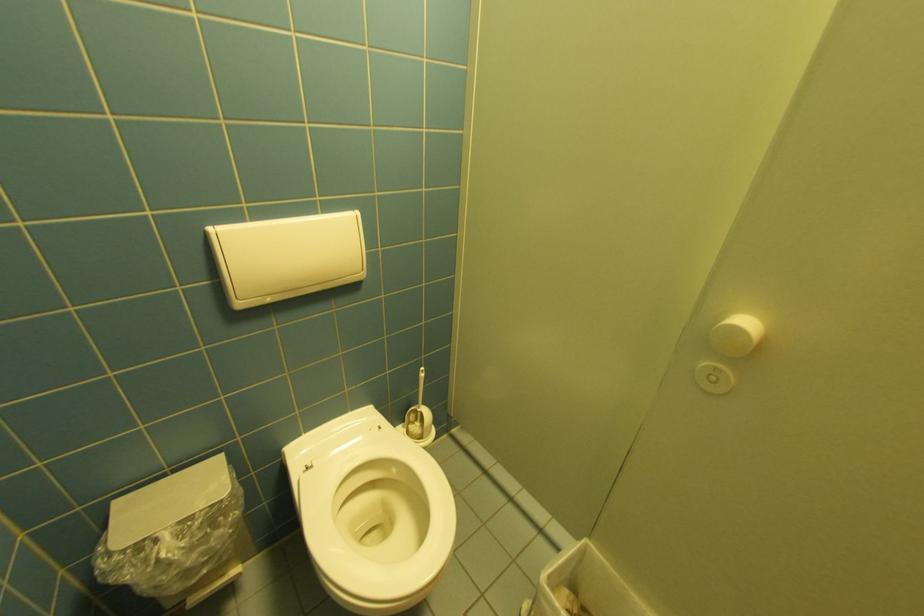
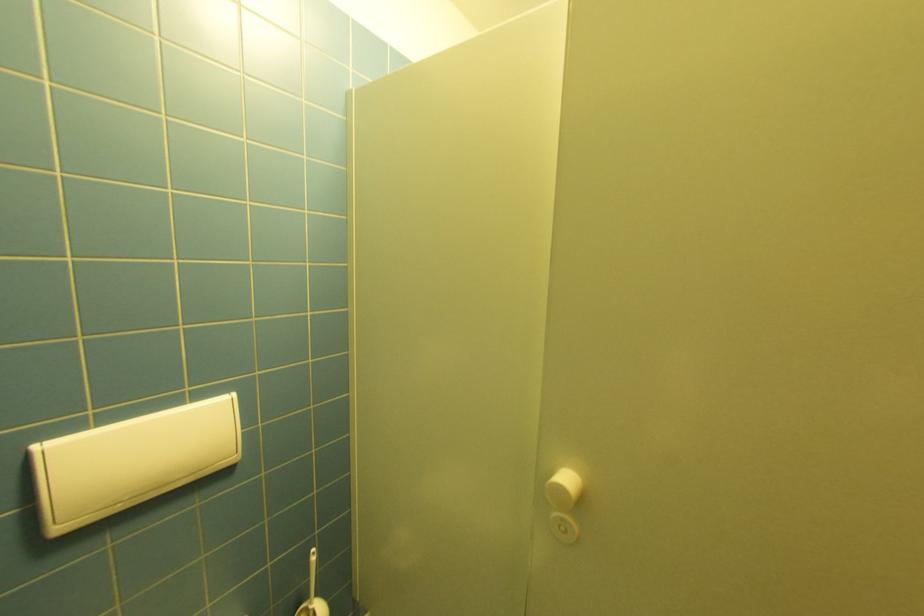
Where in the second image is the point corresponding to pixel 245 305 from the first image?

(66, 530)